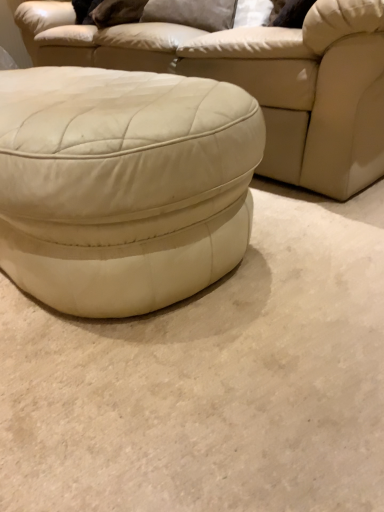
The width and height of the screenshot is (384, 512). What do you see at coordinates (192, 13) in the screenshot?
I see `suede-like gray pillow at upper center` at bounding box center [192, 13].

The width and height of the screenshot is (384, 512). Describe the element at coordinates (258, 80) in the screenshot. I see `matte white ottoman at center` at that location.

Identify the location of white leather ottoman at center. This screenshot has height=512, width=384. (122, 185).

What's the angular difference between white leather ottoman at center and white leather ottoman at center's facing directions?

180 degrees.

Would you consider white leather ottoman at center to be distant from white leather ottoman at center?

No, white leather ottoman at center is in close proximity to white leather ottoman at center.

Is white leather ottoman at center oriented towards white leather ottoman at center?

No, white leather ottoman at center does not turn towards white leather ottoman at center.

Do you think white leather ottoman at center is within suede-like gray pillow at upper center, or outside of it?

white leather ottoman at center is not enclosed by suede-like gray pillow at upper center.

Based on the photo, from a real-world perspective, is white leather ottoman at center over suede-like gray pillow at upper center?

Incorrect, from a real-world perspective, white leather ottoman at center is lower than suede-like gray pillow at upper center.

What are the coordinates of `concrete below the white leather ottoman at center (from the image's perspective)` in the screenshot? It's located at (212, 380).

How many degrees apart are the facing directions of white leather ottoman at center and white leather ottoman at center?

They differ by 180 degrees in their facing directions.

From a real-world perspective, is white leather ottoman at center over white leather ottoman at center?

No, from a real-world perspective, white leather ottoman at center is not over white leather ottoman at center

Is white leather ottoman at center located outside white leather ottoman at center?

white leather ottoman at center is positioned outside white leather ottoman at center.

How much distance is there between white leather ottoman at center and matte white ottoman at center?

They are 34.37 inches apart.

Based on their sizes in the image, would you say white leather ottoman at center is bigger or smaller than matte white ottoman at center?

white leather ottoman at center is smaller than matte white ottoman at center.

Is point (293, 414) in front of point (278, 148)?

Yes, it is.

Which of these two, white leather ottoman at center or matte white ottoman at center, stands taller?

matte white ottoman at center.

Which object is closer to the camera taking this photo, matte white ottoman at center or suede-like gray pillow at upper center?

matte white ottoman at center is in front.

Is matte white ottoman at center with suede-like gray pillow at upper center?

No, matte white ottoman at center is not next to suede-like gray pillow at upper center.

Is point (329, 66) positioned after point (189, 4)?

No, (329, 66) is closer to viewer.

Is matte white ottoman at center facing towards suede-like gray pillow at upper center?

Yes, matte white ottoman at center is facing suede-like gray pillow at upper center.

Looking at this image, does suede-like gray pillow at upper center touch white leather ottoman at center?

suede-like gray pillow at upper center is not next to white leather ottoman at center, and they're not touching.

From the picture: From a real-world perspective, which is physically below, suede-like gray pillow at upper center or white leather ottoman at center?

white leather ottoman at center is physically lower.

Is suede-like gray pillow at upper center to the right of white leather ottoman at center from the viewer's perspective?

Yes, suede-like gray pillow at upper center is to the right of white leather ottoman at center.

Is suede-like gray pillow at upper center not inside white leather ottoman at center?

Yes, suede-like gray pillow at upper center is outside of white leather ottoman at center.

Is white leather ottoman at center positioned far away from suede-like gray pillow at upper center?

white leather ottoman at center is positioned a significant distance from suede-like gray pillow at upper center.

Is white leather ottoman at center behind suede-like gray pillow at upper center?

No, it is in front of suede-like gray pillow at upper center.

You are a GUI agent. You are given a task and a screenshot of the screen. Output one action in this format:
    pyautogui.click(x=<x>, y=<y>)
    Task: Click on the stool above the white leather ottoman at center (from the image's perspective)
    
    Given the screenshot: What is the action you would take?
    pyautogui.click(x=122, y=185)

Locate an element on the screen. pillow lying behind the white leather ottoman at center is located at coordinates (192, 13).

Which object lies nearer to the anchor point suede-like gray pillow at upper center, matte white ottoman at center or white leather ottoman at center?

Based on the image, matte white ottoman at center appears to be nearer to suede-like gray pillow at upper center.

When comparing their distances from matte white ottoman at center, does white leather ottoman at center or white leather ottoman at center seem closer?

Among the two, white leather ottoman at center is located nearer to matte white ottoman at center.

When comparing their distances from white leather ottoman at center, does white leather ottoman at center or matte white ottoman at center seem further?

matte white ottoman at center is further to white leather ottoman at center.

Which object lies nearer to the anchor point white leather ottoman at center, suede-like gray pillow at upper center or white leather ottoman at center?

white leather ottoman at center is positioned closer to the anchor white leather ottoman at center.

When comparing their distances from white leather ottoman at center, does white leather ottoman at center or suede-like gray pillow at upper center seem closer?

The object closer to white leather ottoman at center is white leather ottoman at center.

Estimate the real-world distances between objects in this image. Which object is further from matte white ottoman at center, white leather ottoman at center or suede-like gray pillow at upper center?

Based on the image, white leather ottoman at center appears to be further to matte white ottoman at center.

Considering their positions, is matte white ottoman at center positioned closer to white leather ottoman at center than white leather ottoman at center?

The object closer to white leather ottoman at center is white leather ottoman at center.

Looking at the image, which one is located closer to white leather ottoman at center, matte white ottoman at center or white leather ottoman at center?

Among the two, white leather ottoman at center is located nearer to white leather ottoman at center.

Where is `studio couch between white leather ottoman at center and suede-like gray pillow at upper center along the z-axis`? Image resolution: width=384 pixels, height=512 pixels. studio couch between white leather ottoman at center and suede-like gray pillow at upper center along the z-axis is located at coordinates point(258,80).

Locate an element on the screen. Image resolution: width=384 pixels, height=512 pixels. studio couch positioned between white leather ottoman at center and suede-like gray pillow at upper center from near to far is located at coordinates (258, 80).

Find the location of `stool between matte white ottoman at center and white leather ottoman at center in the up-down direction`. stool between matte white ottoman at center and white leather ottoman at center in the up-down direction is located at coordinates (122, 185).

You are a GUI agent. You are given a task and a screenshot of the screen. Output one action in this format:
    pyautogui.click(x=<x>, y=<y>)
    Task: Click on the stool positioned between white leather ottoman at center and suede-like gray pillow at upper center from near to far
    This screenshot has width=384, height=512.
    Given the screenshot: What is the action you would take?
    pyautogui.click(x=122, y=185)